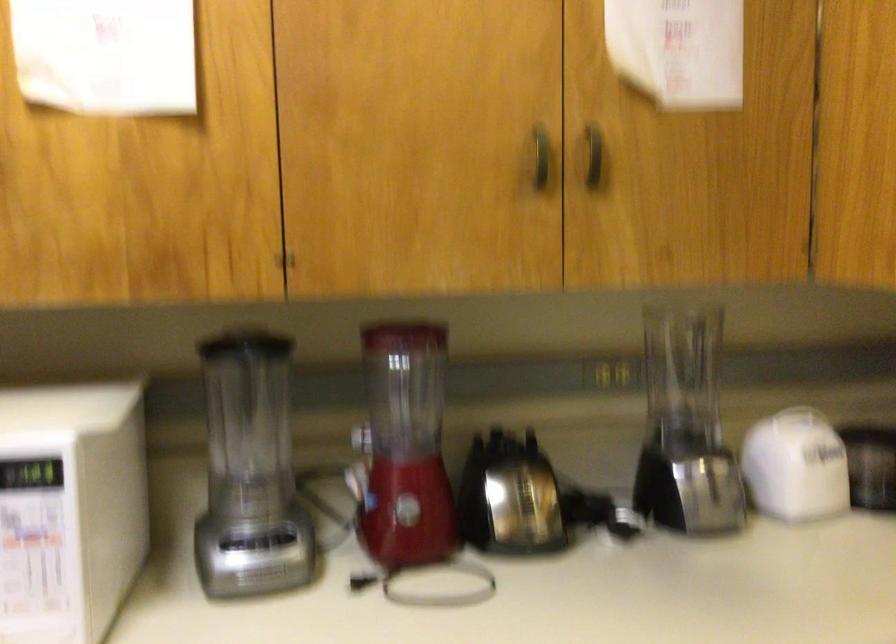
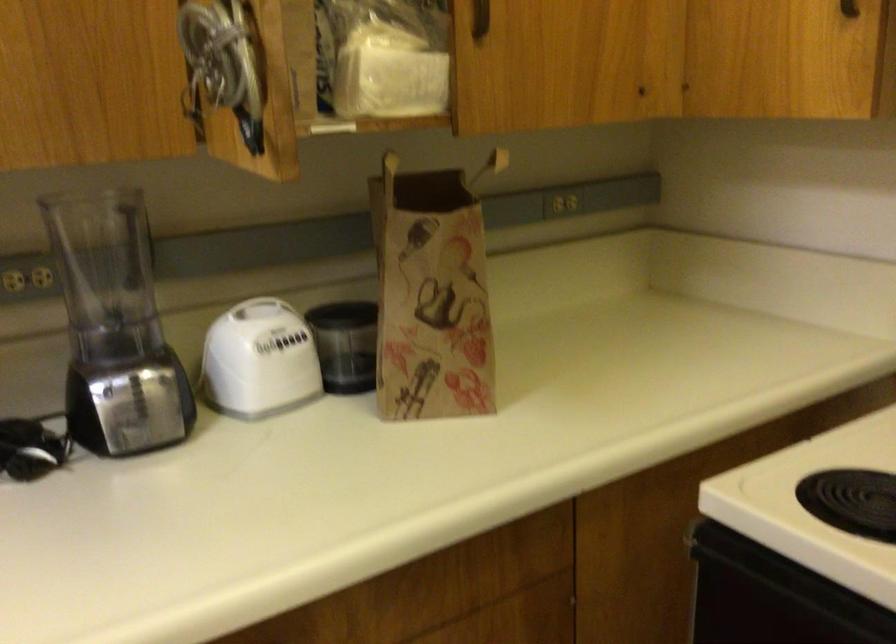
Find the pixel in the second image that matches point 796,421 in the first image.

(260, 308)